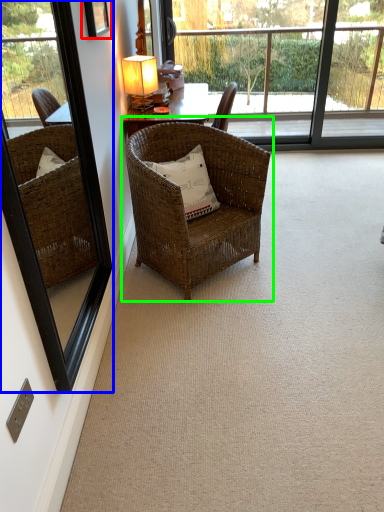
Question: Based on their relative distances, which object is farther from picture frame (highlighted by a red box)? Choose from window frame (highlighted by a blue box) and chair (highlighted by a green box).

Choices:
 (A) window frame
 (B) chair

Answer: (B)